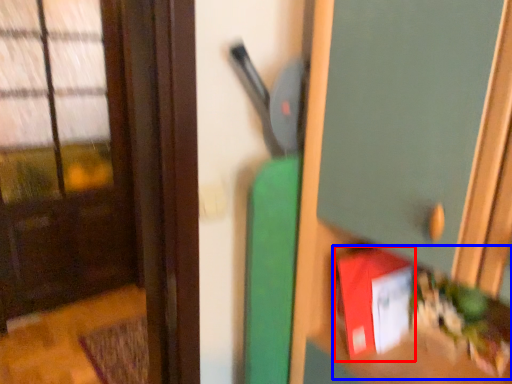
Question: Which point is further to the camera, book (highlighted by a red box) or book (highlighted by a blue box)?

Choices:
 (A) book
 (B) book

Answer: (A)